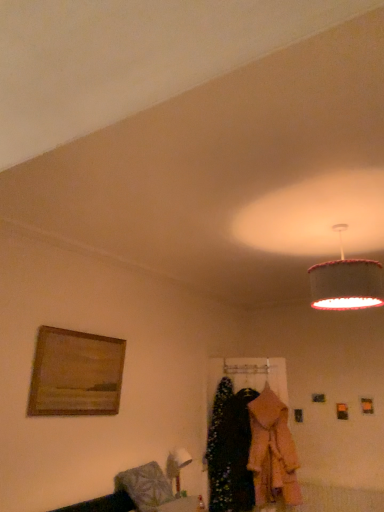
Question: Is point (243, 485) closer or farther from the camera than point (48, 382)?

Choices:
 (A) farther
 (B) closer

Answer: (A)

Question: Visually, is velvet black dress at center, which is the 1th clothing from left to right, positioned to the left or to the right of wooden framed painting at left?

Choices:
 (A) left
 (B) right

Answer: (B)

Question: Considering the real-world distances, which object is farthest from the velvet black dress at center, marked as the 2th clothing in a right-to-left arrangement?

Choices:
 (A) wooden framed painting at left
 (B) textured fabric lampshade at upper right
 (C) light pink fabric coat at center, which is the 1th clothing in right-to-left order

Answer: (B)

Question: Which of these objects is positioned closest to the velvet black dress at center, which is the 1th clothing from left to right?

Choices:
 (A) light pink fabric coat at center, which is the 1th clothing in right-to-left order
 (B) wooden framed painting at left
 (C) textured fabric lampshade at upper right

Answer: (A)